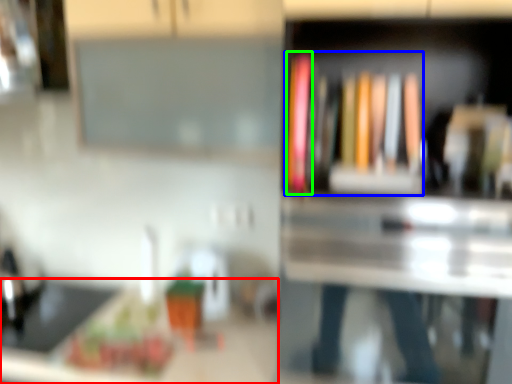
Question: Which object is the closest to the counter top (highlighted by a red box)? Choose among these: book (highlighted by a blue box) or book (highlighted by a green box).

Choices:
 (A) book
 (B) book

Answer: (A)